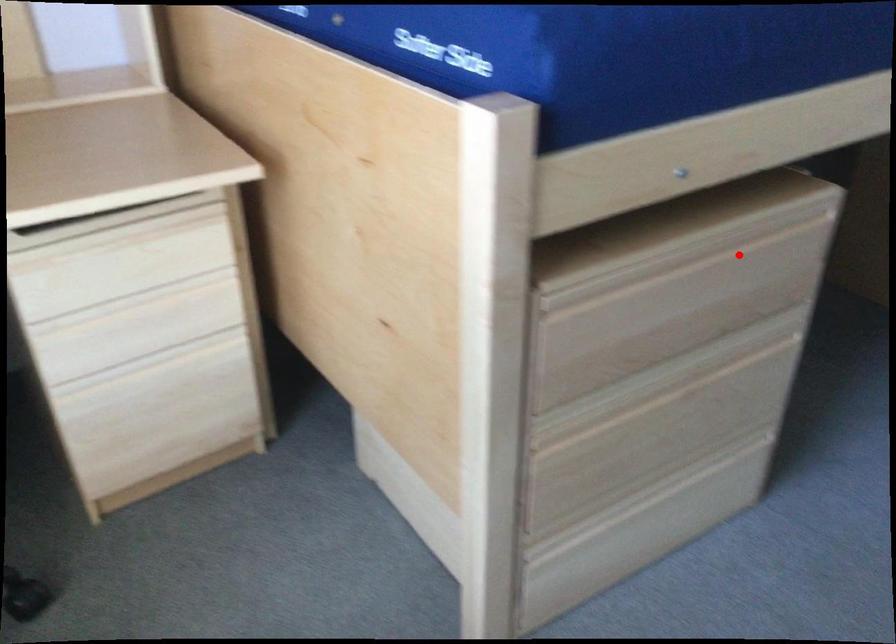
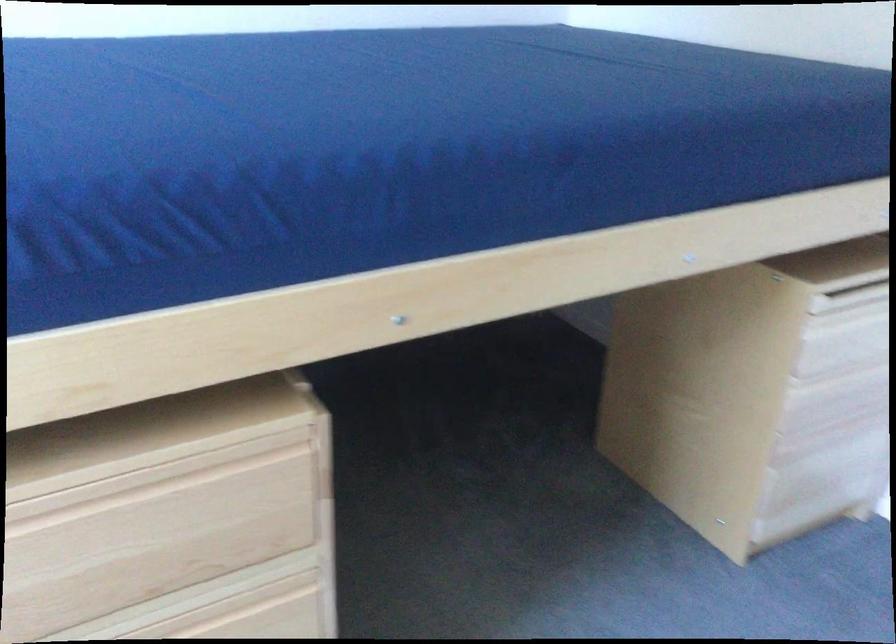
Where in the second image is the point corresponding to the highlighted location from the first image?

(174, 494)